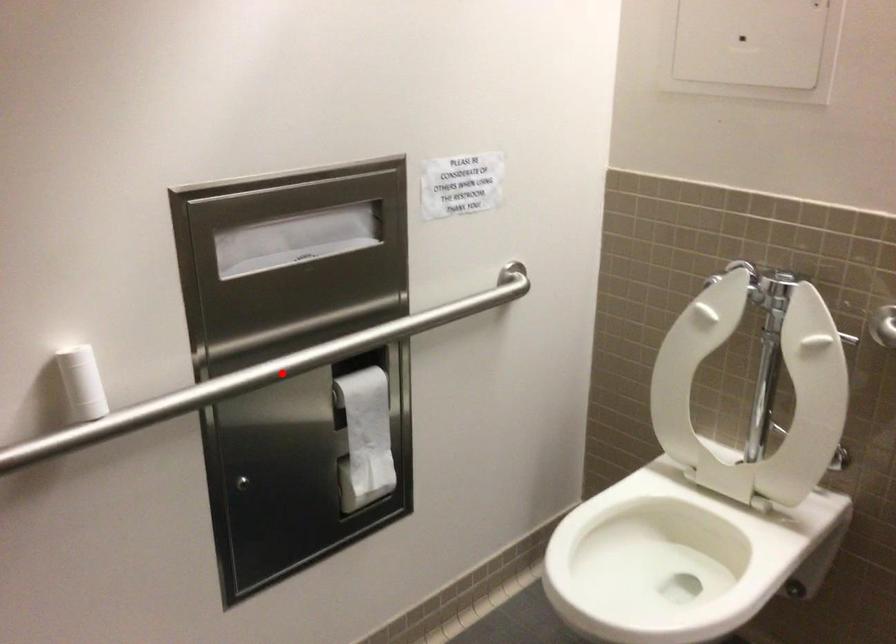
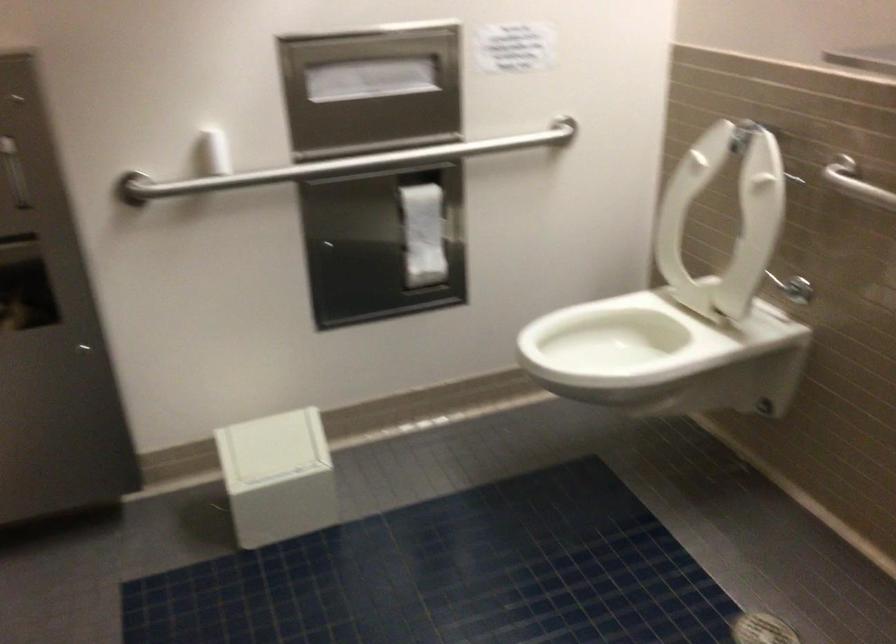
Question: I am providing you with two images of the same scene from different viewpoints. Image1 has a red point marked. In image2, the corresponding 3D location appears at what relative position? Reply with the corresponding letter.

Choices:
 (A) Closer
 (B) Farther

Answer: (B)